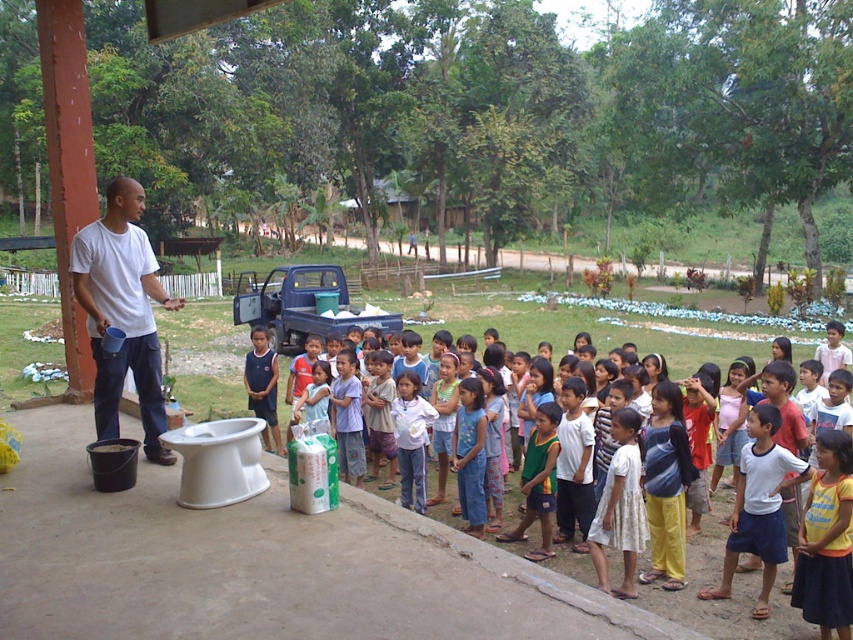
You are a photographer trying to capture a photo of the white matte shirt at left and the light blue denim shorts at center. Which object is positioned closer to the camera?

The white matte shirt at left is closer to the viewer than the light blue denim shorts at center, so it will appear closer to the camera.

You are a photographer standing at the center of the scene. You need to take a photo of the white matte shirt at left. Where should you position your camera to capture the shirt in the frame?

The white matte shirt at left is located at the coordinates point (122, 312), so position your camera to aim towards that point to capture it in the frame.